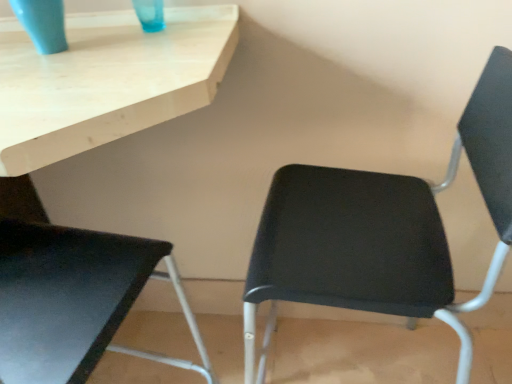
Question: In which direction should I rotate to look at black plastic chair at center, which is the first chair from right to left?

Choices:
 (A) left
 (B) right

Answer: (B)

Question: Can you confirm if black plastic chair at center, positioned as the 2th chair in left-to-right order, is shorter than matte black chair at lower left, which appears as the 2th chair when viewed from the right?

Choices:
 (A) yes
 (B) no

Answer: (B)

Question: Is black plastic chair at center, positioned as the 2th chair in left-to-right order, next to matte black chair at lower left, which is counted as the first chair, starting from the left, and touching it?

Choices:
 (A) yes
 (B) no

Answer: (B)

Question: From the image's perspective, is black plastic chair at center, positioned as the 2th chair in left-to-right order, on matte black chair at lower left, which appears as the 2th chair when viewed from the right?

Choices:
 (A) no
 (B) yes

Answer: (B)

Question: From the image's perspective, is black plastic chair at center, positioned as the 2th chair in left-to-right order, beneath matte black chair at lower left, which appears as the 2th chair when viewed from the right?

Choices:
 (A) no
 (B) yes

Answer: (A)

Question: Is black plastic chair at center, which is the first chair from right to left, closer to the viewer compared to matte black chair at lower left, which is counted as the first chair, starting from the left?

Choices:
 (A) yes
 (B) no

Answer: (B)

Question: From a real-world perspective, is black plastic chair at center, which is the first chair from right to left, located beneath matte black chair at lower left, which is counted as the first chair, starting from the left?

Choices:
 (A) no
 (B) yes

Answer: (A)

Question: From the image's perspective, would you say black plastic chair at center, positioned as the 2th chair in left-to-right order, is positioned over matte blue glass at upper left?

Choices:
 (A) yes
 (B) no

Answer: (B)

Question: Considering the relative sizes of black plastic chair at center, positioned as the 2th chair in left-to-right order, and matte blue glass at upper left in the image provided, is black plastic chair at center, positioned as the 2th chair in left-to-right order, bigger than matte blue glass at upper left?

Choices:
 (A) yes
 (B) no

Answer: (A)

Question: Can you confirm if black plastic chair at center, positioned as the 2th chair in left-to-right order, is wider than matte blue glass at upper left?

Choices:
 (A) yes
 (B) no

Answer: (A)

Question: Can matte blue glass at upper left be found inside black plastic chair at center, positioned as the 2th chair in left-to-right order?

Choices:
 (A) no
 (B) yes

Answer: (A)

Question: Is black plastic chair at center, positioned as the 2th chair in left-to-right order, at the right side of matte blue glass at upper left?

Choices:
 (A) yes
 (B) no

Answer: (A)

Question: Does black plastic chair at center, which is the first chair from right to left, have a lesser width compared to matte blue glass at upper left?

Choices:
 (A) yes
 (B) no

Answer: (B)

Question: From a real-world perspective, is matte blue glass at upper left positioned under black plastic chair at center, which is the first chair from right to left, based on gravity?

Choices:
 (A) no
 (B) yes

Answer: (A)